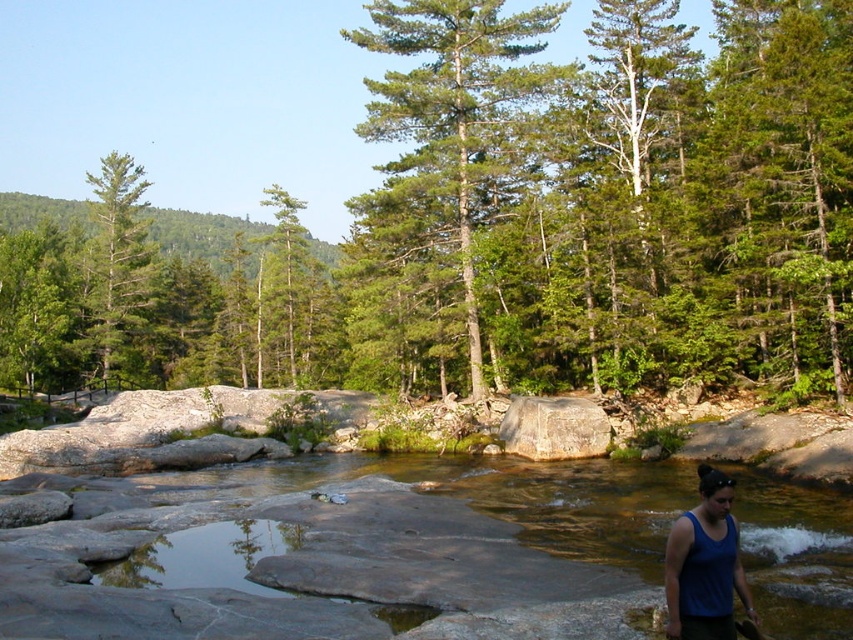
Question: Among these objects, which one is farthest from the camera?

Choices:
 (A) smooth gray rock at center
 (B) green textured tree at center

Answer: (B)

Question: Is green matte tree at center smaller than smooth gray rock at center?

Choices:
 (A) yes
 (B) no

Answer: (B)

Question: Does clear water at center lie in front of blue fabric tank top at lower right?

Choices:
 (A) no
 (B) yes

Answer: (A)

Question: Which object is positioned closest to the green textured tree at center?

Choices:
 (A) blue fabric tank top at lower right
 (B) green matte tree at left
 (C) green matte tree at center

Answer: (A)

Question: Can you confirm if green textured tree at center is positioned above blue fabric tank top at lower right?

Choices:
 (A) no
 (B) yes

Answer: (B)

Question: Which object is farther from the camera taking this photo?

Choices:
 (A) green matte tree at center
 (B) blue fabric tank top at lower right
 (C) smooth gray rock at center
 (D) green matte tree at left

Answer: (D)